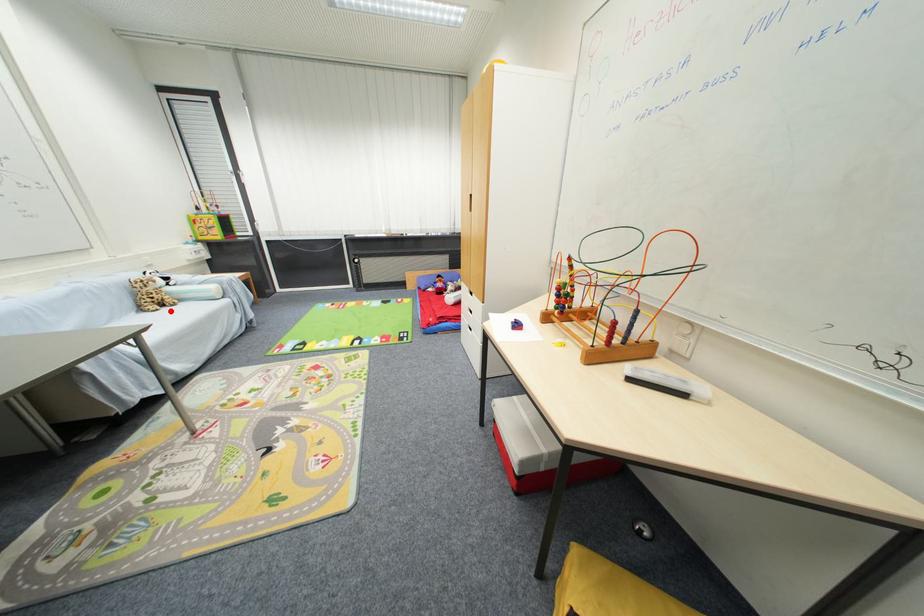
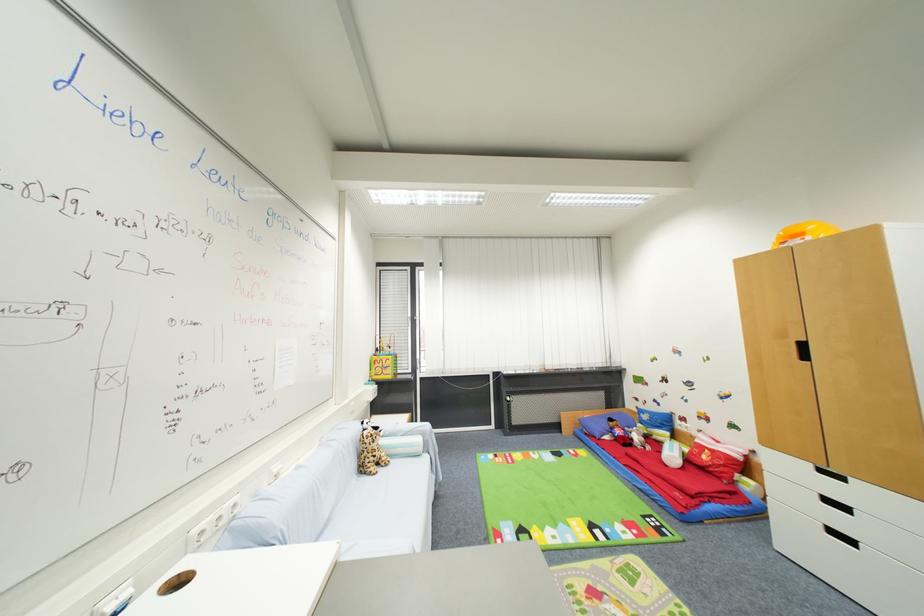
Find the pixel in the second image that matches the highlighted location in the first image.

(385, 472)